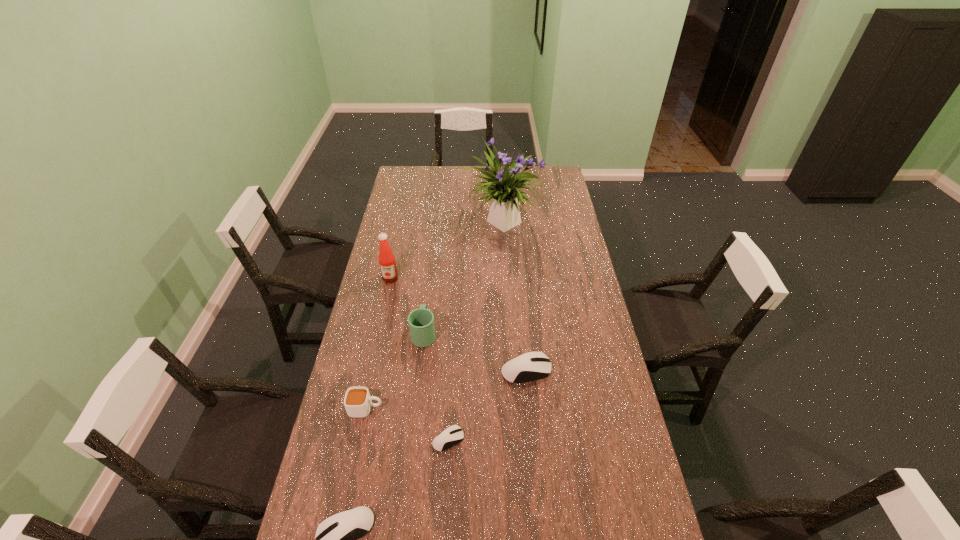
The image size is (960, 540). I want to click on vacant place for an extra mouse on the right, so coord(588,316).